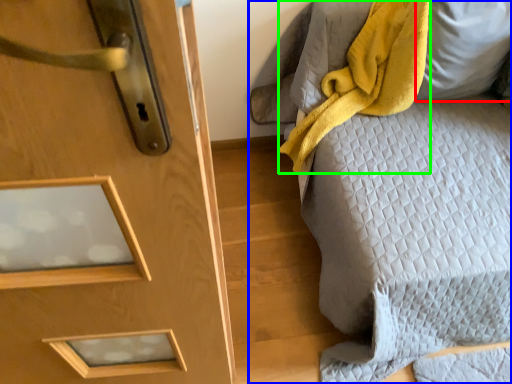
Question: Which object is the farthest from pillow (highlighted by a red box)? Choose among these: furniture (highlighted by a blue box) or blanket (highlighted by a green box).

Choices:
 (A) furniture
 (B) blanket

Answer: (A)